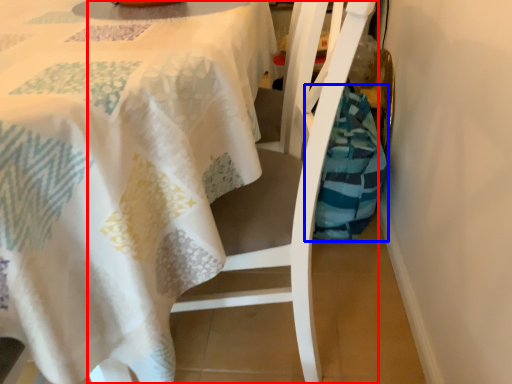
Question: Which of the following is the closest to the observer, chair (highlighted by a red box) or material (highlighted by a blue box)?

Choices:
 (A) chair
 (B) material

Answer: (A)